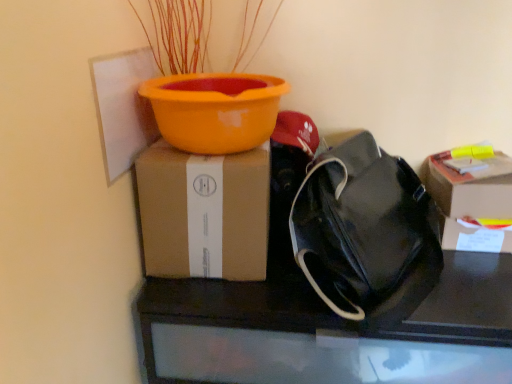
Question: Is brown cardboard box at upper left, positioned as the second box in right-to-left order, taller than black leather bag at center?

Choices:
 (A) yes
 (B) no

Answer: (B)

Question: Considering the relative sizes of brown cardboard box at upper left, which is counted as the 1th box, starting from the left, and black leather bag at center in the image provided, is brown cardboard box at upper left, which is counted as the 1th box, starting from the left, thinner than black leather bag at center?

Choices:
 (A) no
 (B) yes

Answer: (B)

Question: Is brown cardboard box at upper left, positioned as the second box in right-to-left order, smaller than black leather bag at center?

Choices:
 (A) yes
 (B) no

Answer: (A)

Question: Does brown cardboard box at upper left, which is counted as the 1th box, starting from the left, have a greater width compared to black leather bag at center?

Choices:
 (A) no
 (B) yes

Answer: (A)

Question: Considering the relative sizes of brown cardboard box at upper left, positioned as the second box in right-to-left order, and black leather bag at center in the image provided, is brown cardboard box at upper left, positioned as the second box in right-to-left order, bigger than black leather bag at center?

Choices:
 (A) no
 (B) yes

Answer: (A)

Question: Is brown cardboard box at upper left, which is counted as the 1th box, starting from the left, in contact with black leather bag at center?

Choices:
 (A) no
 (B) yes

Answer: (A)

Question: Is brown cardboard box at upper left, positioned as the second box in right-to-left order, smaller than cardboard box at right, which appears as the 1th box when viewed from the right?

Choices:
 (A) yes
 (B) no

Answer: (B)

Question: Is brown cardboard box at upper left, positioned as the second box in right-to-left order, positioned before cardboard box at right, arranged as the second box when viewed from the left?

Choices:
 (A) yes
 (B) no

Answer: (A)

Question: Considering the relative sizes of brown cardboard box at upper left, which is counted as the 1th box, starting from the left, and cardboard box at right, arranged as the second box when viewed from the left, in the image provided, is brown cardboard box at upper left, which is counted as the 1th box, starting from the left, thinner than cardboard box at right, arranged as the second box when viewed from the left,?

Choices:
 (A) no
 (B) yes

Answer: (A)

Question: From a real-world perspective, is brown cardboard box at upper left, which is counted as the 1th box, starting from the left, beneath cardboard box at right, which appears as the 1th box when viewed from the right?

Choices:
 (A) yes
 (B) no

Answer: (B)

Question: Is brown cardboard box at upper left, which is counted as the 1th box, starting from the left, to the left of cardboard box at right, which appears as the 1th box when viewed from the right, from the viewer's perspective?

Choices:
 (A) no
 (B) yes

Answer: (B)

Question: Is brown cardboard box at upper left, which is counted as the 1th box, starting from the left, bigger than cardboard box at right, arranged as the second box when viewed from the left?

Choices:
 (A) yes
 (B) no

Answer: (A)

Question: From a real-world perspective, is cardboard box at right, which appears as the 1th box when viewed from the right, physically above black leather bag at center?

Choices:
 (A) no
 (B) yes

Answer: (B)